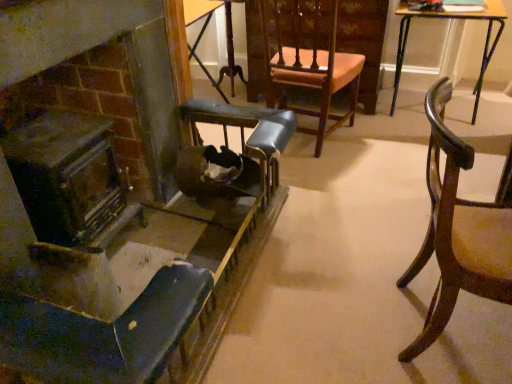
Question: Based on their sizes in the image, would you say dark brown wood fireplace at left is bigger or smaller than wooden chair with upholstered seat at center, the 2th chair positioned from the left?

Choices:
 (A) small
 (B) big

Answer: (A)

Question: From their relative heights in the image, would you say dark brown wood fireplace at left is taller or shorter than wooden chair with upholstered seat at center, the 2th chair positioned from the right?

Choices:
 (A) tall
 (B) short

Answer: (B)

Question: Which is farther from the metallic blue chair at left, the first chair from the left?

Choices:
 (A) wooden chair with upholstered seat at center, the 2th chair positioned from the left
 (B) wooden table at center, which is the 2th table in right-to-left order
 (C) mahogany wood chair at right, the 1th chair in the right-to-left sequence
 (D) wooden table at upper right, which ranks as the 2th table in left-to-right order
 (E) dark brown wood fireplace at left

Answer: (D)

Question: Considering the real-world distances, which object is closest to the mahogany wood chair at right, acting as the third chair starting from the left?

Choices:
 (A) wooden chair with upholstered seat at center, the 2th chair positioned from the right
 (B) metallic blue chair at left, the first chair from the left
 (C) dark brown wood fireplace at left
 (D) wooden table at upper right, which ranks as the 1th table in right-to-left order
 (E) wooden table at center, marked as the 1th table in a left-to-right arrangement

Answer: (B)